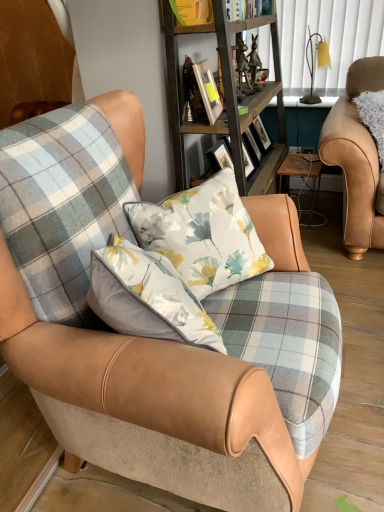
What do you see at coordinates (303, 179) in the screenshot?
I see `wooden table at center` at bounding box center [303, 179].

The image size is (384, 512). I want to click on plaid fabric chair at center, the 2th chair viewed from the back, so click(137, 337).

Locate an element on the screen. wooden shelf at center is located at coordinates (224, 93).

The width and height of the screenshot is (384, 512). Describe the element at coordinates (248, 9) in the screenshot. I see `hardcover book at upper center` at that location.

This screenshot has height=512, width=384. In order to click on metallic silver picture frame at upper center in this screenshot , I will do `click(208, 90)`.

Between wooden shelf at center and matte yellow lampshade at upper right, which one is positioned behind?

Positioned behind is matte yellow lampshade at upper right.

Is wooden shelf at center positioned with its back to matte yellow lampshade at upper right?

wooden shelf at center is not turned away from matte yellow lampshade at upper right.

Which is behind, leather armchair at right, placed as the second chair when sorted from front to back, or hardcover book at upper center?

hardcover book at upper center is more distant.

From a real-world perspective, is leather armchair at right, placed as the first chair when sorted from back to front, positioned over hardcover book at upper center based on gravity?

No, from a real-world perspective, leather armchair at right, placed as the first chair when sorted from back to front, is not over hardcover book at upper center

From the image's perspective, which chair is the 1st one below the hardcover book at upper center? Please provide its 2D coordinates.

[(356, 159)]

From the image's perspective, is leather armchair at right, placed as the first chair when sorted from back to front, below hardcover book at upper center?

Indeed, from the image's perspective, leather armchair at right, placed as the first chair when sorted from back to front, is shown beneath hardcover book at upper center.

In terms of size, does wooden table at center appear bigger or smaller than plaid fabric chair at center, which is the first chair in left-to-right order?

wooden table at center is smaller than plaid fabric chair at center, which is the first chair in left-to-right order.

Considering the sizes of wooden table at center and plaid fabric chair at center, which is the first chair in left-to-right order, in the image, is wooden table at center taller or shorter than plaid fabric chair at center, which is the first chair in left-to-right order,?

In the image, wooden table at center appears to be shorter than plaid fabric chair at center, which is the first chair in left-to-right order.

Is wooden table at center not inside plaid fabric chair at center, the 2th chair viewed from the back?

That's correct, wooden table at center is outside of plaid fabric chair at center, the 2th chair viewed from the back.

Does wooden table at center come behind plaid fabric chair at center, arranged as the 1th chair when viewed from the front?

Yes, it is.

Between point (325, 128) and point (170, 78), which one is positioned behind?

Point (325, 128)

In the scene shown: Is leather armchair at right, placed as the first chair when sorted from back to front, oriented away from wooden shelf at center?

Absolutely, leather armchair at right, placed as the first chair when sorted from back to front, is directed away from wooden shelf at center.

Does leather armchair at right, placed as the second chair when sorted from front to back, come behind wooden shelf at center?

Yes, the depth of leather armchair at right, placed as the second chair when sorted from front to back, is greater than that of wooden shelf at center.

Are matte yellow lampshade at upper right and hardcover book at upper center located far from each other?

No, there isn't a large distance between matte yellow lampshade at upper right and hardcover book at upper center.

Is matte yellow lampshade at upper right thinner than hardcover book at upper center?

Yes.

Is matte yellow lampshade at upper right turned away from hardcover book at upper center?

matte yellow lampshade at upper right is not turned away from hardcover book at upper center.

Is matte yellow lampshade at upper right smaller than hardcover book at upper center?

Indeed, matte yellow lampshade at upper right has a smaller size compared to hardcover book at upper center.

Is the depth of plaid fabric chair at center, the 2th chair viewed from the back, less than that of wooden shelf at center?

Yes, it is.

Consider the image. Between plaid fabric chair at center, which is the first chair in left-to-right order, and wooden shelf at center, which one has less height?

Standing shorter between the two is plaid fabric chair at center, which is the first chair in left-to-right order.

Could you tell me if plaid fabric chair at center, the 2th chair viewed from the back, is turned towards wooden shelf at center?

No, plaid fabric chair at center, the 2th chair viewed from the back, is not turned towards wooden shelf at center.

Is wooden table at center not near hardcover book at upper center?

wooden table at center is near hardcover book at upper center, not far away.

Could you tell me if wooden table at center is turned towards hardcover book at upper center?

No, wooden table at center is not oriented towards hardcover book at upper center.

How different are the orientations of wooden table at center and hardcover book at upper center in degrees?

They differ by 90.9 degrees in their facing directions.

From a real-world perspective, who is located higher, wooden table at center or hardcover book at upper center?

hardcover book at upper center, from a real-world perspective.

Where is `lamp on the right of wooden shelf at center`? lamp on the right of wooden shelf at center is located at coordinates (313, 67).

There is a hardcover book at upper center. Find the location of `the 1st chair below it (from the image's perspective)`. the 1st chair below it (from the image's perspective) is located at coordinates [356, 159].

Which object lies nearer to the anchor point plaid fabric chair at center, marked as the second chair in a right-to-left arrangement, wooden shelf at center or leather armchair at right, placed as the first chair when sorted from back to front?

wooden shelf at center.

When comparing their distances from hardcover book at upper center, does wooden shelf at center or leather armchair at right, arranged as the second chair when viewed from the left, seem closer?

wooden shelf at center lies closer to hardcover book at upper center than the other object.

From the image, which object appears to be nearer to metallic silver picture frame at upper center, hardcover book at upper center or matte yellow lampshade at upper right?

hardcover book at upper center lies closer to metallic silver picture frame at upper center than the other object.

Looking at the image, which one is located further to hardcover book at upper center, wooden table at center or matte yellow lampshade at upper right?

Among the two, wooden table at center is located further to hardcover book at upper center.

Based on their spatial positions, is matte yellow lampshade at upper right or hardcover book at upper center closer to wooden table at center?

Among the two, matte yellow lampshade at upper right is located nearer to wooden table at center.

Which object lies further to the anchor point wooden shelf at center, wooden table at center or plaid fabric chair at center, the 2th chair viewed from the back?

plaid fabric chair at center, the 2th chair viewed from the back, is positioned further to the anchor wooden shelf at center.

From the image, which object appears to be nearer to wooden shelf at center, wooden table at center or leather armchair at right, arranged as the second chair when viewed from the left?

The object closer to wooden shelf at center is wooden table at center.

From the image, which object appears to be farther from plaid fabric chair at center, the 2th chair viewed from the back, leather armchair at right, placed as the second chair when sorted from front to back, or hardcover book at upper center?

Among the two, hardcover book at upper center is located further to plaid fabric chair at center, the 2th chair viewed from the back.

Where is `chair between hardcover book at upper center and wooden table at center in the up-down direction`? chair between hardcover book at upper center and wooden table at center in the up-down direction is located at coordinates (356, 159).

The height and width of the screenshot is (512, 384). What are the coordinates of `picture frame between plaid fabric chair at center, arranged as the 1th chair when viewed from the front, and matte yellow lampshade at upper right in the front-back direction` in the screenshot? It's located at (208, 90).

The height and width of the screenshot is (512, 384). Find the location of `table situated between metallic silver picture frame at upper center and leather armchair at right, placed as the first chair when sorted from back to front, from left to right`. table situated between metallic silver picture frame at upper center and leather armchair at right, placed as the first chair when sorted from back to front, from left to right is located at coordinates (303, 179).

You are a GUI agent. You are given a task and a screenshot of the screen. Output one action in this format:
    pyautogui.click(x=<x>, y=<y>)
    Task: Click on the shelf between hardcover book at upper center and leather armchair at right, arranged as the second chair when viewed from the left, from left to right
    This screenshot has height=512, width=384.
    Given the screenshot: What is the action you would take?
    pyautogui.click(x=224, y=93)